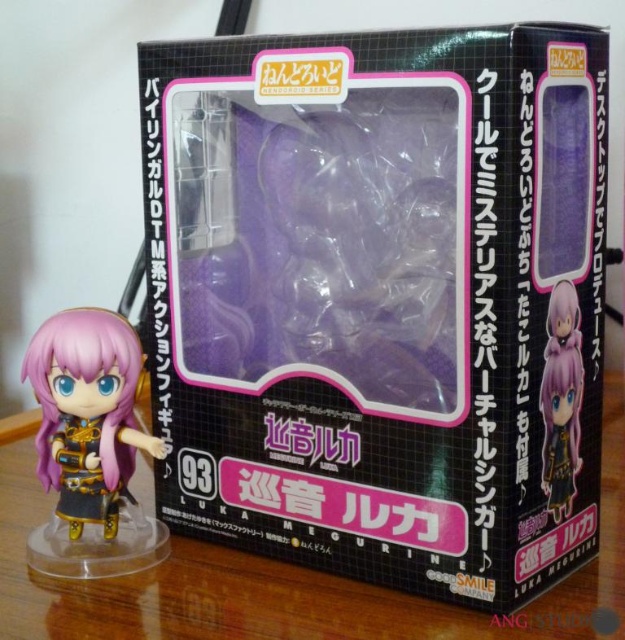
Question: In this image, where is transparent plastic table at lower center located relative to satin purple figurine at lower right?

Choices:
 (A) below
 (B) above

Answer: (A)

Question: Which of these objects is positioned farthest from the matte black figure at lower left?

Choices:
 (A) satin purple figurine at lower right
 (B) transparent plastic table at lower center
 (C) transparent plastic figure at center

Answer: (A)

Question: Which object appears farthest from the camera in this image?

Choices:
 (A) satin purple figurine at lower right
 (B) matte black figure at lower left
 (C) transparent plastic figure at center
 (D) transparent plastic table at lower center

Answer: (B)

Question: Which point is closer to the camera taking this photo?

Choices:
 (A) (312, 276)
 (B) (18, 467)
 (C) (72, 348)

Answer: (C)

Question: Can you confirm if transparent plastic table at lower center is positioned below satin purple figurine at lower right?

Choices:
 (A) no
 (B) yes

Answer: (B)

Question: Does transparent plastic figure at center appear over satin purple figurine at lower right?

Choices:
 (A) no
 (B) yes

Answer: (B)